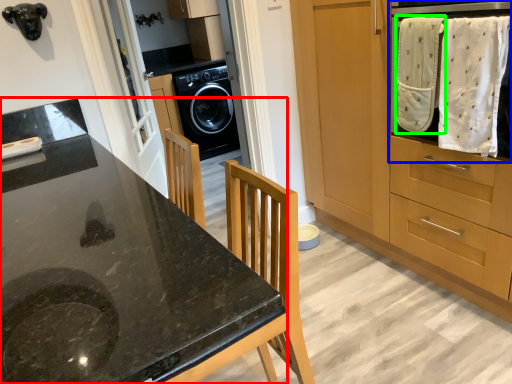
Question: Based on their relative distances, which object is farther from countertop (highlighted by a red box)? Choose from home appliance (highlighted by a blue box) and baby clothe (highlighted by a green box).

Choices:
 (A) home appliance
 (B) baby clothe

Answer: (A)